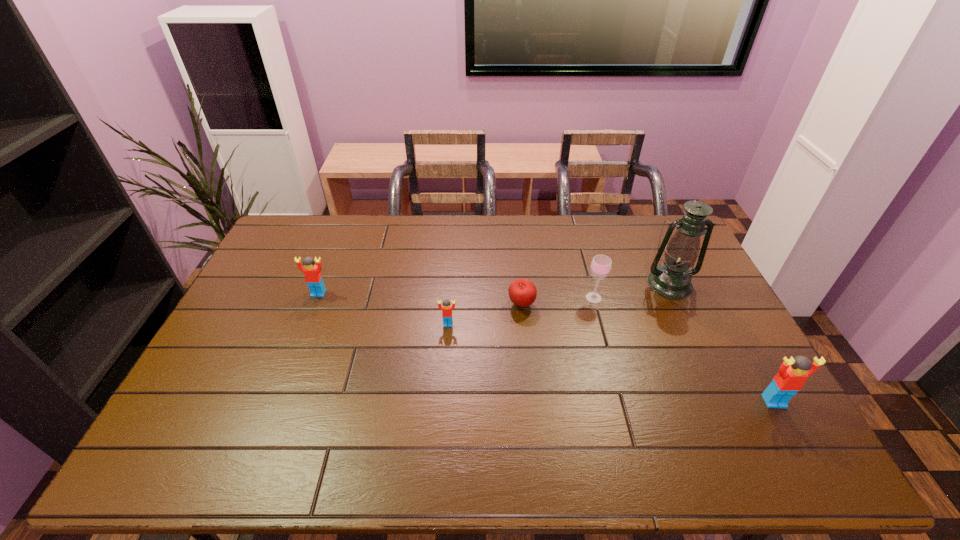
Find the location of a particular element. vacant space at the right edge is located at coordinates click(x=650, y=257).

Image resolution: width=960 pixels, height=540 pixels. In order to click on vacant space at the far left corner of the desktop in this screenshot , I will do `click(318, 227)`.

The image size is (960, 540). What are the coordinates of `vacant region between the nearest Lego and the oil lamp` in the screenshot? It's located at (722, 342).

In order to click on vacant space in between the rightmost Lego and the tallest object in this screenshot , I will do `click(722, 342)`.

The width and height of the screenshot is (960, 540). I want to click on unoccupied position between the second nearest Lego and the leftmost Lego, so click(383, 309).

Where is `free space between the leftmost Lego and the second farthest Lego`? free space between the leftmost Lego and the second farthest Lego is located at coordinates 383,309.

Locate an element on the screen. The width and height of the screenshot is (960, 540). unoccupied area between the farthest Lego and the nearest object is located at coordinates (546, 347).

Identify the location of free point between the wineglass and the tallest object. The width and height of the screenshot is (960, 540). (632, 291).

Identify the location of vacant point located between the fourth object from left to right and the fourth object from right to left. (558, 301).

Locate an element on the screen. Image resolution: width=960 pixels, height=540 pixels. empty location between the second Lego from left to right and the oil lamp is located at coordinates (559, 304).